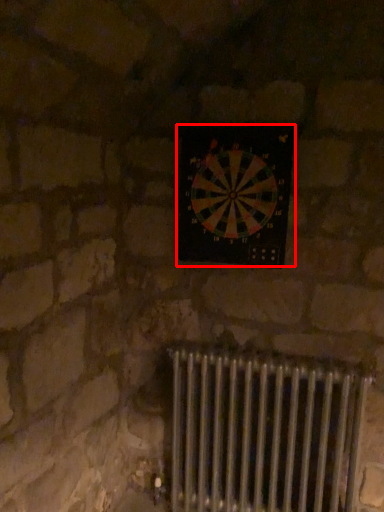
Question: Considering the relative positions of wall clock (annotated by the red box) and radiator in the image provided, where is wall clock (annotated by the red box) located with respect to the staircase?

Choices:
 (A) right
 (B) left

Answer: (B)